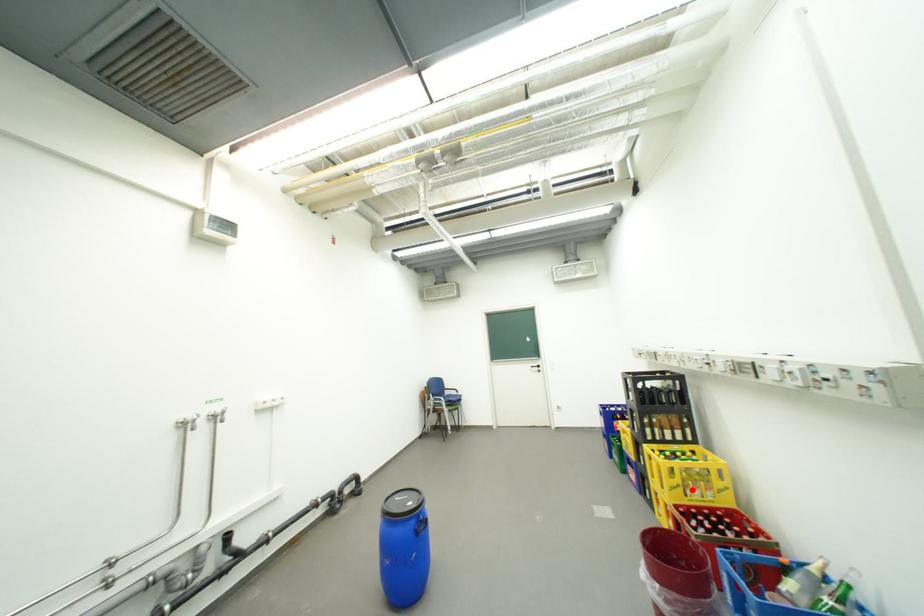
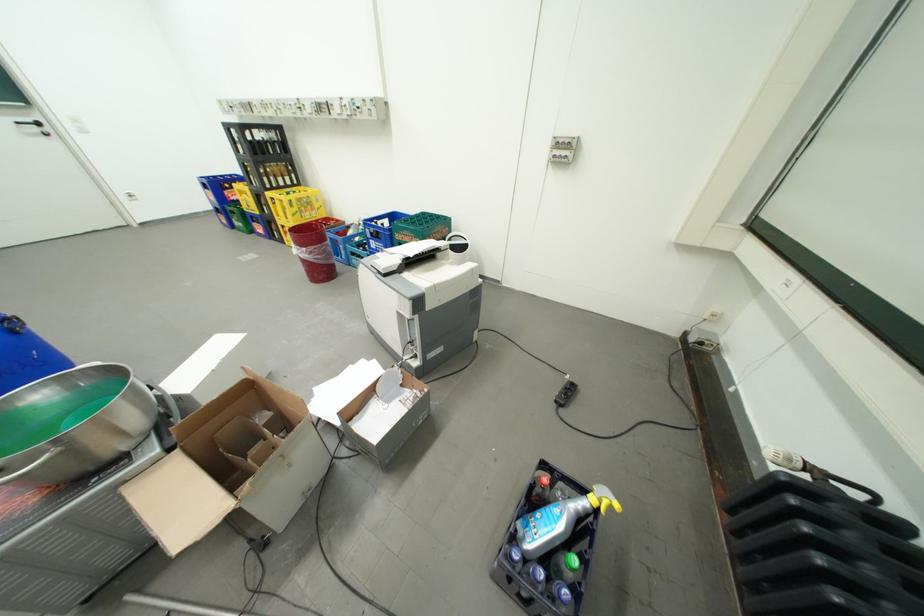
Question: A red point is marked in image1. In image2, is the corresponding 3D point closer to the camera or farther? Reply with the corresponding letter.

Choices:
 (A) The corresponding 3D point is closer.
 (B) The corresponding 3D point is farther.

Answer: (A)